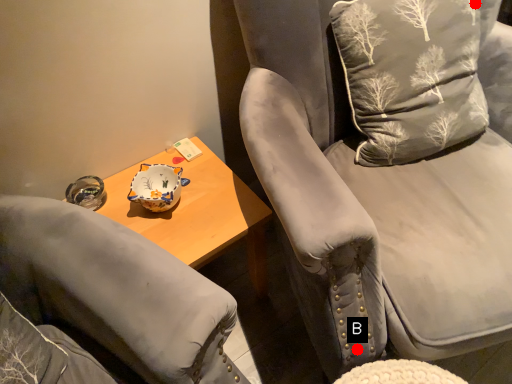
Question: Two points are circled on the image, labeled by A and B beside each circle. Which point is further to the camera?

Choices:
 (A) A is further
 (B) B is further

Answer: (A)